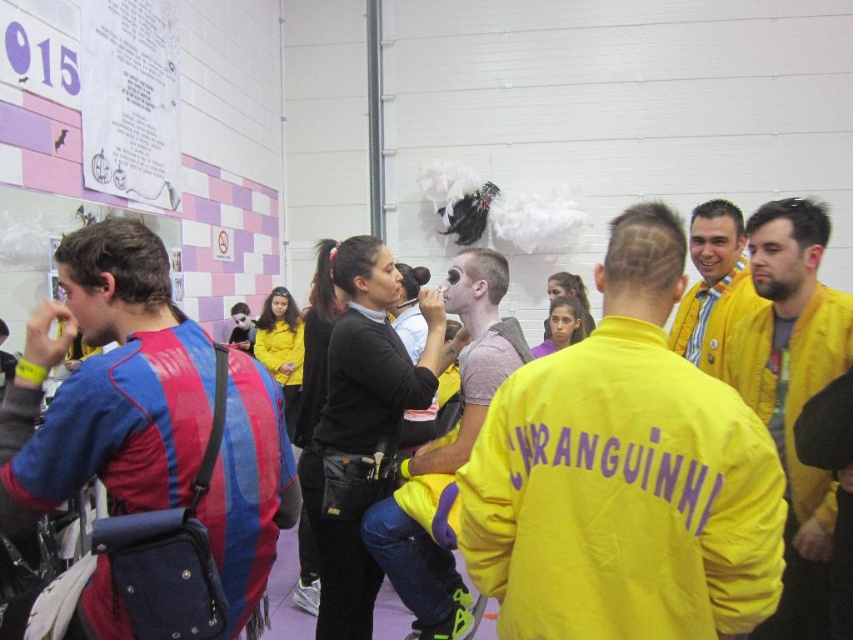
Does blue striped jersey at center have a lesser height compared to yellow matte jacket at right?

Indeed, blue striped jersey at center has a lesser height compared to yellow matte jacket at right.

Who is more forward, (x=146, y=467) or (x=808, y=278)?

Positioned in front is point (x=146, y=467).

Measure the distance between point (x=213, y=477) and camera.

The distance of point (x=213, y=477) from camera is 5.01 feet.

Locate an element on the screen. This screenshot has height=640, width=853. blue striped jersey at center is located at coordinates (108, 385).

Looking at this image, who is taller, yellow fabric jacket at center or matte black shirt at center?

matte black shirt at center is taller.

Can you confirm if yellow fabric jacket at center is positioned to the right of matte black shirt at center?

Correct, you'll find yellow fabric jacket at center to the right of matte black shirt at center.

Between point (483, 589) and point (483, 403), which one is positioned in front?

Positioned in front is point (483, 589).

Find the location of `yellow fabric jacket at center`. yellow fabric jacket at center is located at coordinates [x=624, y=476].

Does yellow matte jacket at right have a smaller size compared to matte black shirt at center?

Correct, yellow matte jacket at right occupies less space than matte black shirt at center.

Does point (780, 452) lie behind point (476, 248)?

That is False.

The image size is (853, 640). Identify the location of yellow matte jacket at right. (793, 390).